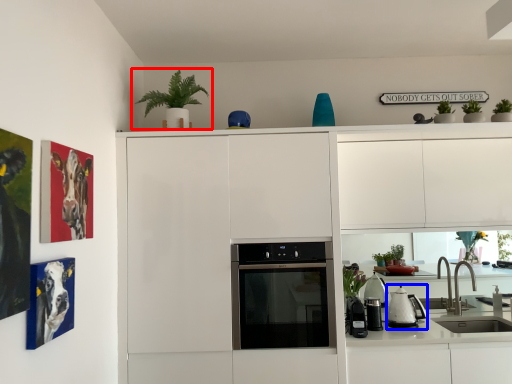
Question: Which object appears closest to the camera in this image, houseplant (highlighted by a red box) or kitchen appliance (highlighted by a blue box)?

Choices:
 (A) houseplant
 (B) kitchen appliance

Answer: (A)